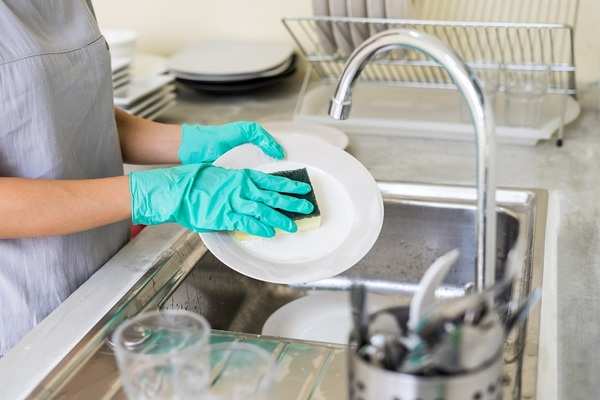
Locate an element on the screen. dish scrubber is located at coordinates (298, 173).